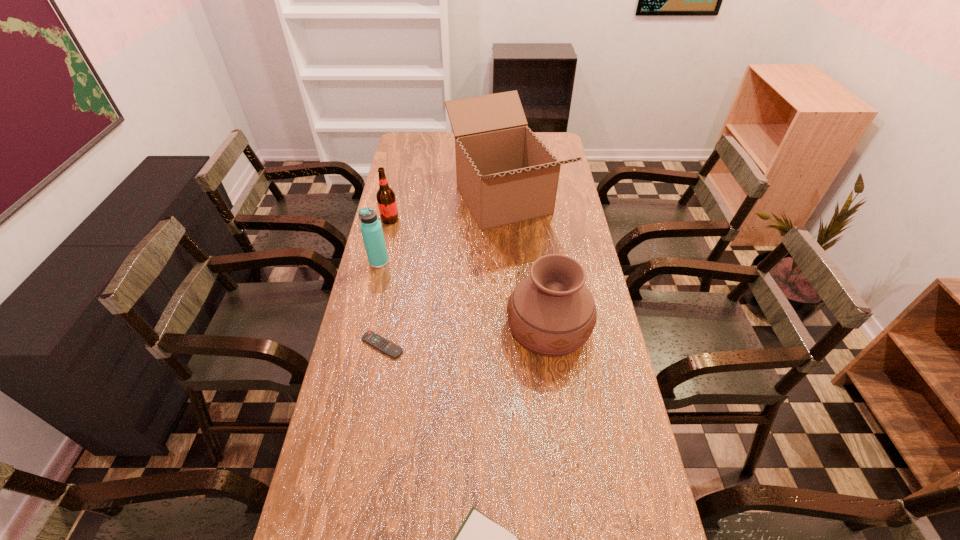
Identify the location of free point that satisfies the following two spatial constraints: 1. on the front side of the remote control; 2. on the right side of the thermos bottle. (360, 346).

Locate an element on the screen. The width and height of the screenshot is (960, 540). vacant area that satisfies the following two spatial constraints: 1. on the front side of the box; 2. on the right side of the urn is located at coordinates (512, 328).

Identify the location of free point that satisfies the following two spatial constraints: 1. on the front side of the remote control; 2. on the left side of the root beer. This screenshot has width=960, height=540. (362, 346).

You are a GUI agent. You are given a task and a screenshot of the screen. Output one action in this format:
    pyautogui.click(x=<x>, y=<y>)
    Task: Click on the free region that satisfies the following two spatial constraints: 1. on the back side of the tallest object; 2. on the right side of the root beer
    Image resolution: width=960 pixels, height=540 pixels.
    Given the screenshot: What is the action you would take?
    pyautogui.click(x=395, y=200)